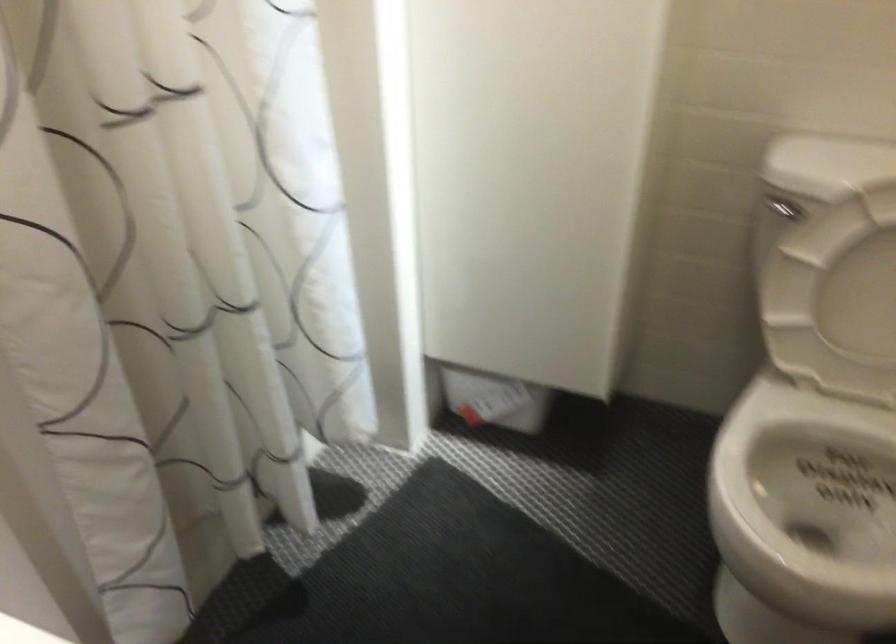
What do you see at coordinates (782, 210) in the screenshot? The image size is (896, 644). I see `a toilet flush lever` at bounding box center [782, 210].